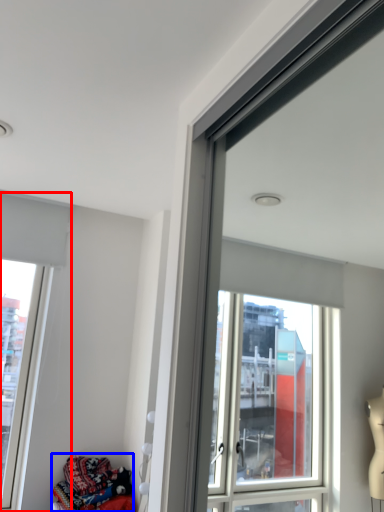
Question: Which point is further to the camera, window (highlighted by a red box) or clothing (highlighted by a blue box)?

Choices:
 (A) window
 (B) clothing

Answer: (A)